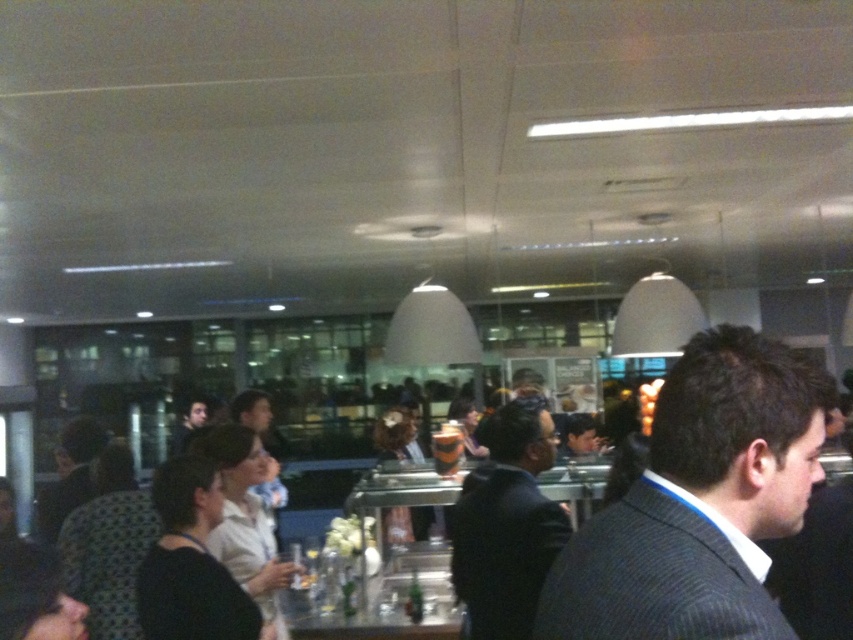
From the picture: Who is positioned more to the left, dark gray suit at center or gray pinstripe suit at center?

gray pinstripe suit at center

From the picture: Does dark gray suit at center have a greater height compared to gray pinstripe suit at center?

Correct, dark gray suit at center is much taller as gray pinstripe suit at center.

Between point (689, 340) and point (663, 580), which one is positioned behind?

Positioned behind is point (689, 340).

This screenshot has width=853, height=640. Identify the location of dark gray suit at center. (700, 500).

Is dark gray suit at center thinner than clear glass table at center?

Yes.

Is point (645, 566) positioned before point (436, 577)?

Yes, point (645, 566) is in front of point (436, 577).

You are a GUI agent. You are given a task and a screenshot of the screen. Output one action in this format:
    pyautogui.click(x=<x>, y=<y>)
    Task: Click on the dark gray suit at center
    This screenshot has height=640, width=853.
    Given the screenshot: What is the action you would take?
    pyautogui.click(x=700, y=500)

Does black suit at center have a lesser height compared to clear glass table at center?

In fact, black suit at center may be taller than clear glass table at center.

What do you see at coordinates (508, 524) in the screenshot?
I see `black suit at center` at bounding box center [508, 524].

Where is `black suit at center`? Image resolution: width=853 pixels, height=640 pixels. black suit at center is located at coordinates (x=508, y=524).